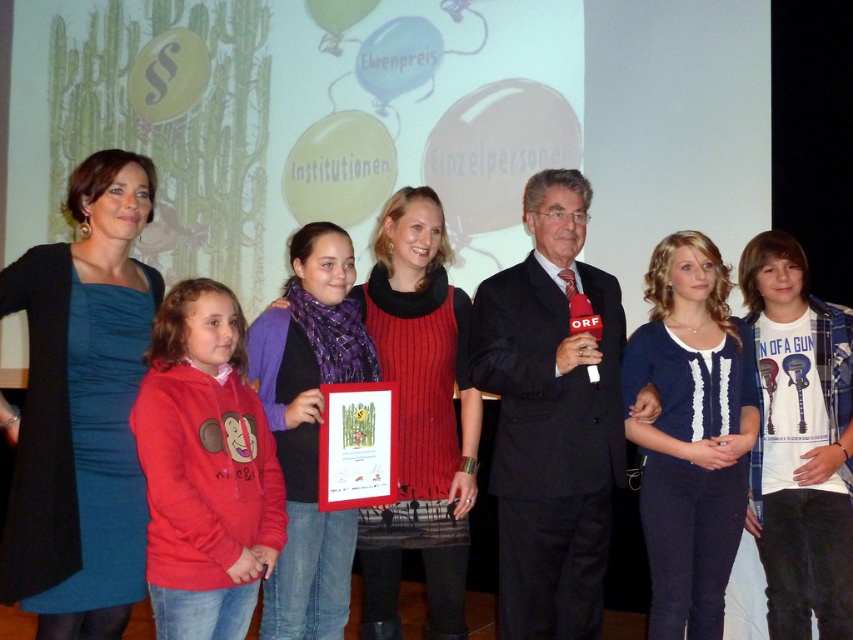
In the scene shown: You are a photographer positioned at the front of the stage. You need to capture a photo that includes both the teal satin dress at center and the matte red sweater at center. Which one of these two items will appear larger in your photo?

The teal satin dress at center will appear larger in the photo because it is closer to the viewer than the matte red sweater at center.

You are an event organizer who needs to arrange a photo shoot for the group. The photographer wants to ensure that the black suit at center and the blue knit sweater at center are positioned exactly 12 inches apart for the perfect shot. Based on the current arrangement, is this adjustment feasible?

The black suit at center is currently 12.54 inches from the blue knit sweater at center. Since the desired distance is 12 inches, the photographer can slightly move them closer to achieve the required separation.

You are an event photographer who needs to capture a group photo of the teal satin dress at center and purple knitwear at center. The camera you are using has a maximum focus range of 20 inches. Can you capture both subjects clearly in the same frame without moving the camera?

The teal satin dress at center is 21.58 inches from the purple knitwear at center. Since the distance between them exceeds the camera maximum focus range of 20 inches, you cannot capture both subjects clearly in the same frame without moving the camera.